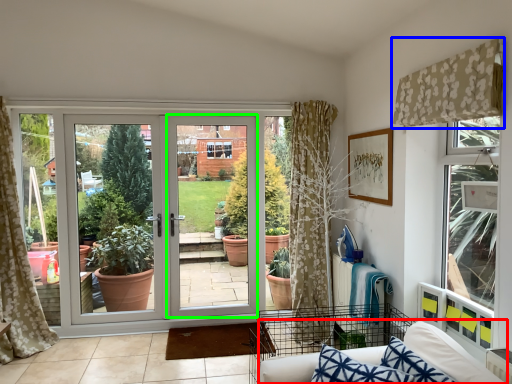
Question: Which is nearer to the couch (highlighted by a red box)? curtain (highlighted by a blue box) or screen door (highlighted by a green box).

Choices:
 (A) curtain
 (B) screen door

Answer: (A)